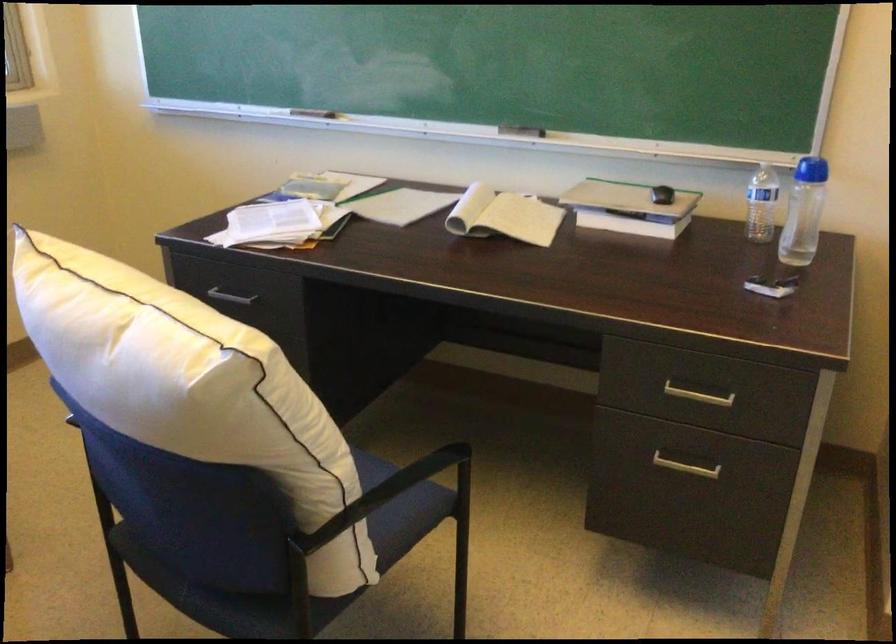
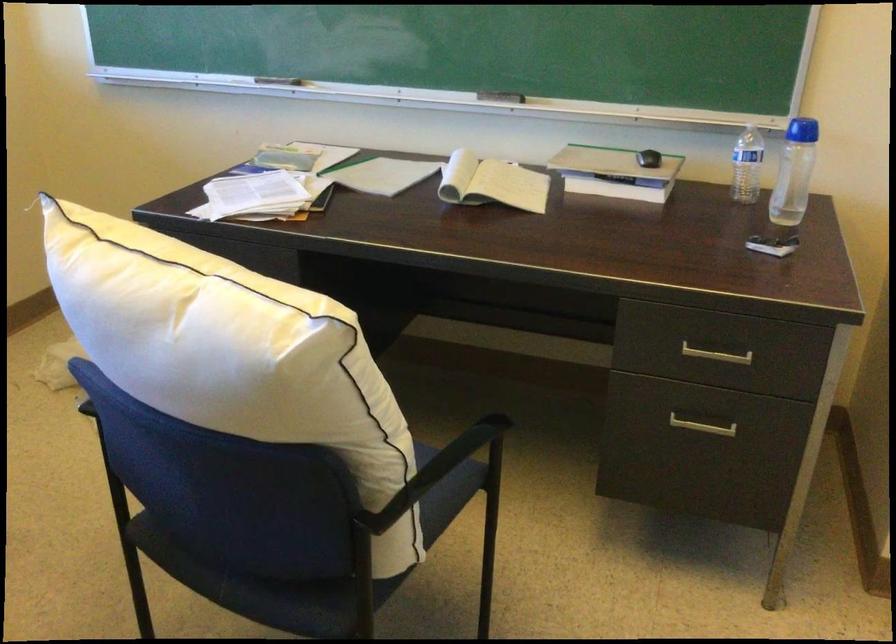
Find the pixel in the second image that matches point (312, 111) in the first image.

(279, 80)